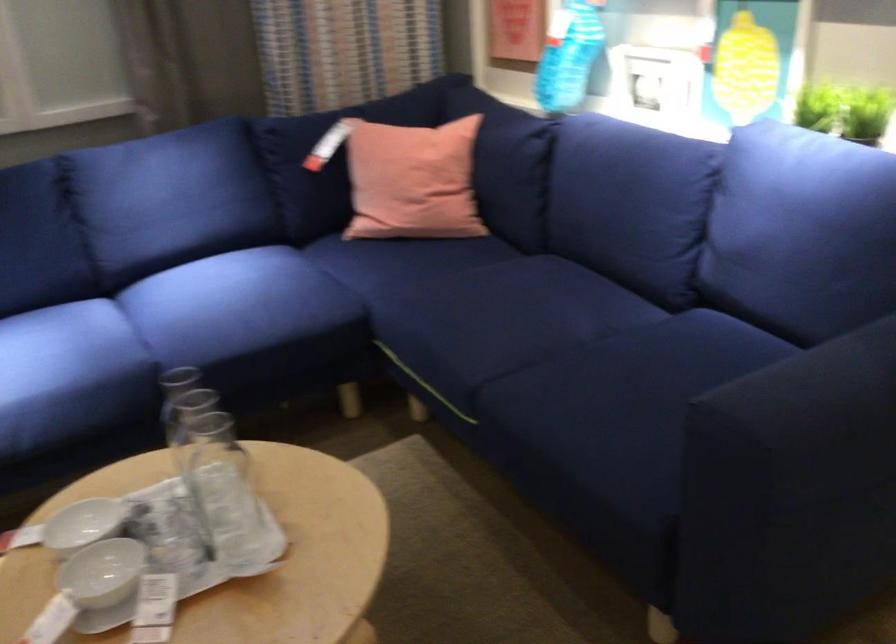
Find the location of `blue sofa sitting surface`. blue sofa sitting surface is located at coordinates (652, 375).